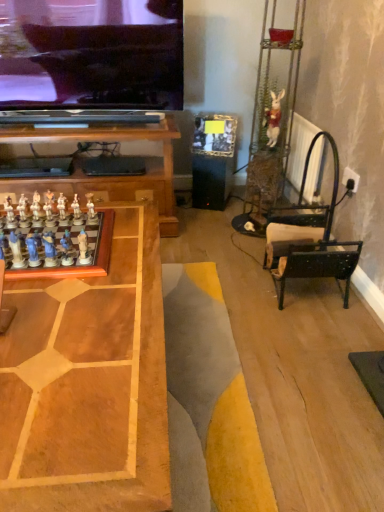
I want to click on vacant space to the right of blue glossy chess piece at left, which ranks as the tenth toy in back-to-front order, so (x=106, y=268).